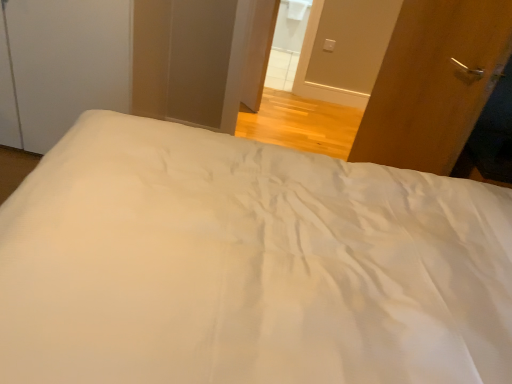
Question: Based on their sizes in the image, would you say white glossy door at upper center, which ranks as the second screen door in left-to-right order, is bigger or smaller than wooden door at right?

Choices:
 (A) small
 (B) big

Answer: (A)

Question: Is point (311, 23) closer or farther from the camera than point (416, 72)?

Choices:
 (A) farther
 (B) closer

Answer: (A)

Question: Which of these objects is positioned farthest from the white smooth bed at center?

Choices:
 (A) white glossy door at upper center, which ranks as the second screen door in left-to-right order
 (B) white matte screen door at upper left, the 1th screen door viewed from the left
 (C) wooden door at right

Answer: (A)

Question: Considering the real-world distances, which object is closest to the white smooth bed at center?

Choices:
 (A) white glossy door at upper center, which ranks as the second screen door in left-to-right order
 (B) wooden door at right
 (C) white matte screen door at upper left, the 2th screen door positioned from the right

Answer: (B)